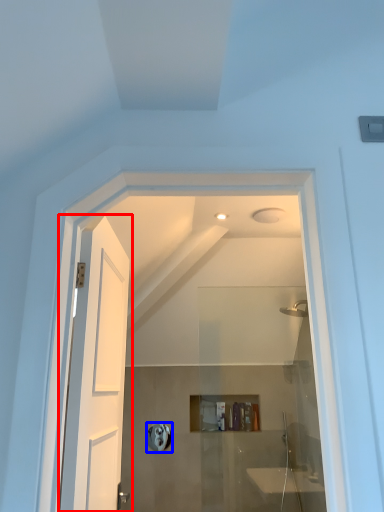
Question: Which object is closer to the camera taking this photo, door (highlighted by a red box) or towel bar (highlighted by a blue box)?

Choices:
 (A) door
 (B) towel bar

Answer: (A)